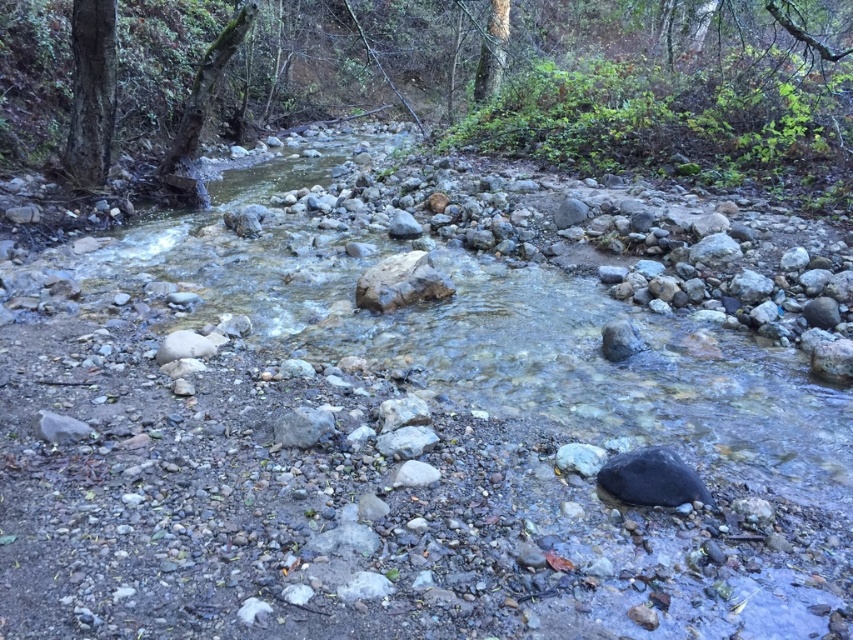
Between smooth bark tree at upper left and smooth gray rock at center, which one has more height?

Standing taller between the two is smooth bark tree at upper left.

Is point (102, 93) closer to viewer compared to point (380, 268)?

No, it is behind (380, 268).

What are the coordinates of `smooth bark tree at upper left` in the screenshot? It's located at (91, 92).

Between smooth gray rock at center and smooth bark tree at upper center, which one has more height?

Standing taller between the two is smooth bark tree at upper center.

This screenshot has height=640, width=853. What do you see at coordinates (401, 282) in the screenshot? I see `smooth gray rock at center` at bounding box center [401, 282].

Locate an element on the screen. smooth gray rock at center is located at coordinates (401, 282).

Which is more to the left, green mossy tree trunk at upper left or smooth bark tree at upper center?

From the viewer's perspective, green mossy tree trunk at upper left appears more on the left side.

Is green mossy tree trunk at upper left closer to the viewer compared to smooth bark tree at upper center?

Yes, it is.

Is point (213, 83) closer to camera compared to point (498, 77)?

Yes, it is in front of point (498, 77).

Find the location of a particular element. The width and height of the screenshot is (853, 640). green mossy tree trunk at upper left is located at coordinates (206, 88).